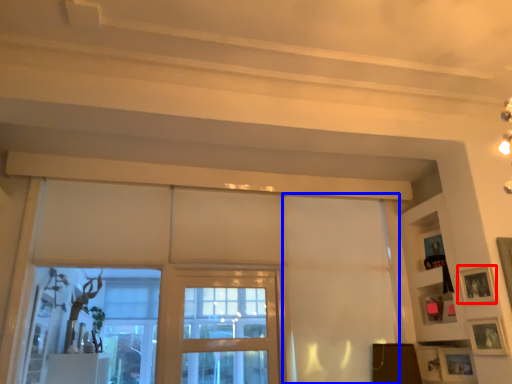
Question: Which point is further to the camera, picture frame (highlighted by a red box) or curtain (highlighted by a blue box)?

Choices:
 (A) picture frame
 (B) curtain

Answer: (B)